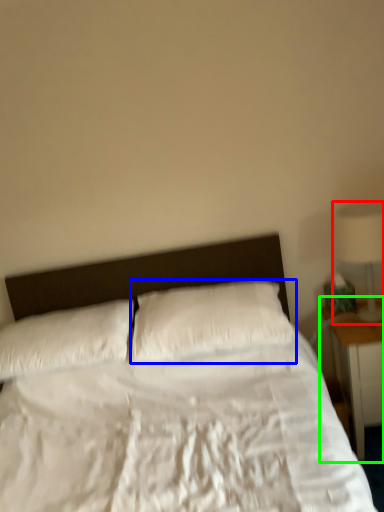
Question: Considering the real-world distances, which object is farthest from lamp (highlighted by a red box)? pillow (highlighted by a blue box) or nightstand (highlighted by a green box)?

Choices:
 (A) pillow
 (B) nightstand

Answer: (A)